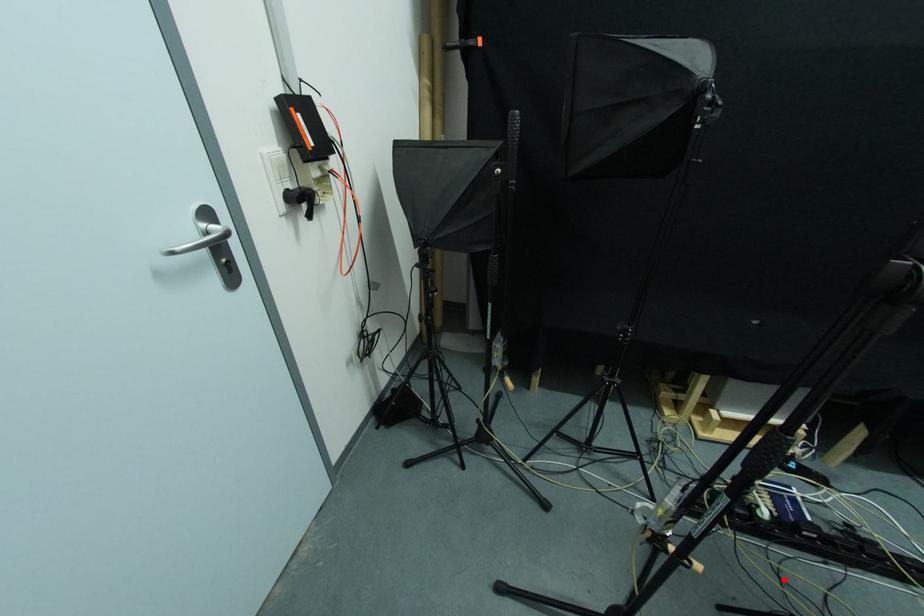
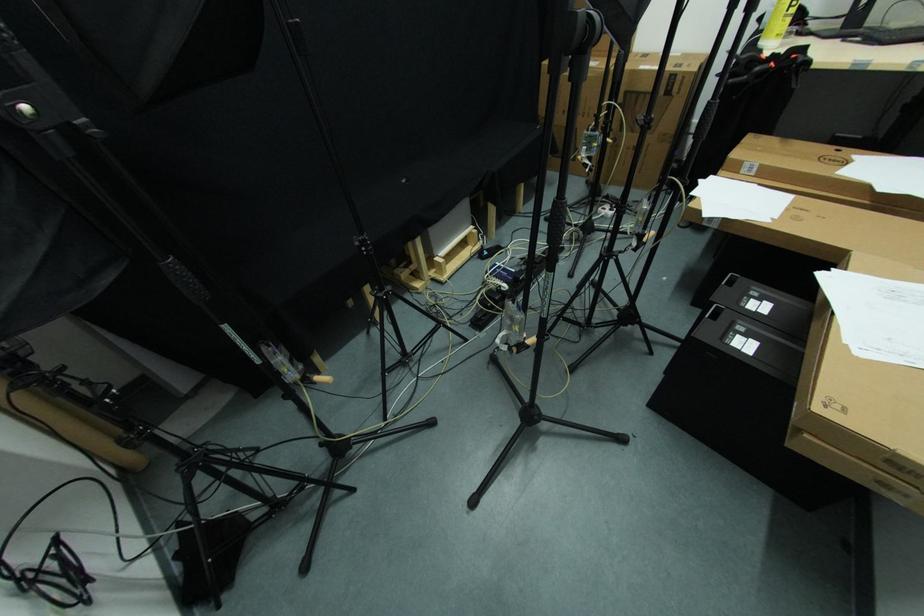
Question: I am providing you with two images of the same scene from different viewpoints. Image1 has a red point marked. In image2, the corresponding 3D location appears at what relative position? Reply with the corresponding letter.

Choices:
 (A) Closer
 (B) Farther

Answer: (B)